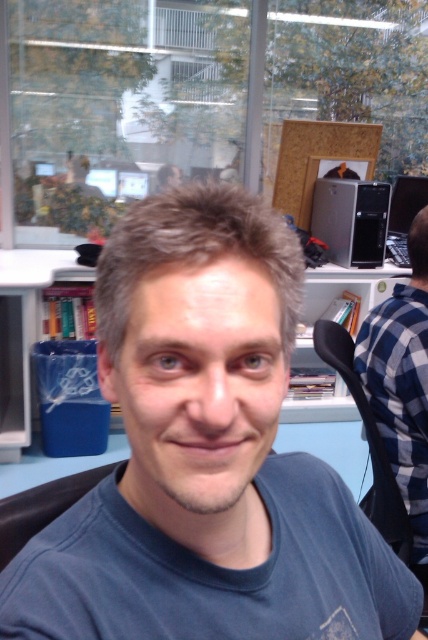
Question: Considering the relative positions of blue plaid shirt at right and black fabric chair at right in the image provided, where is blue plaid shirt at right located with respect to black fabric chair at right?

Choices:
 (A) right
 (B) left

Answer: (A)

Question: Can you confirm if blue plaid shirt at right is bigger than blue plastic bin at lower left?

Choices:
 (A) yes
 (B) no

Answer: (B)

Question: Which of the following is the farthest from the observer?

Choices:
 (A) [65, 563]
 (B) [315, 321]
 (C) [23, 406]
 (D) [350, 266]

Answer: (B)

Question: Which of the following is the farthest from the observer?

Choices:
 (A) blue plastic bin at lower left
 (B) satin black tower at upper right

Answer: (B)

Question: Is blue plastic bin at lower left thinner than black fabric chair at right?

Choices:
 (A) no
 (B) yes

Answer: (A)

Question: Estimate the real-world distances between objects in this image. Which object is closer to the black fabric chair at right?

Choices:
 (A) blue plaid shirt at right
 (B) blue plastic bin at lower left
 (C) satin black tower at upper right

Answer: (A)